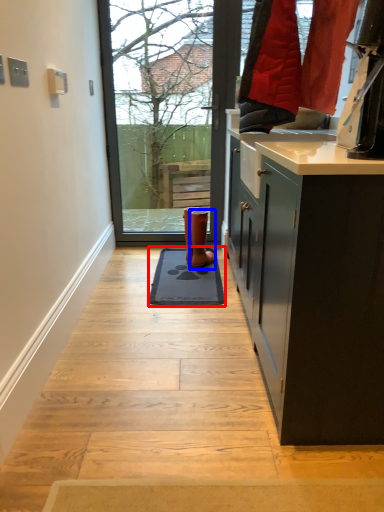
Question: Which of the following is the closest to the observer, doormat (highlighted by a red box) or footwear (highlighted by a blue box)?

Choices:
 (A) doormat
 (B) footwear

Answer: (A)